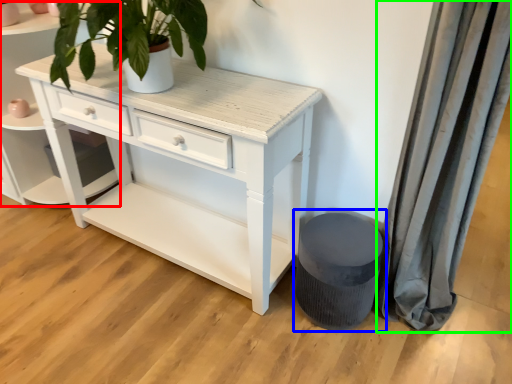
Question: Based on their relative distances, which object is nearer to shelf (highlighted by a red box)? Choose from music stool (highlighted by a blue box) and curtain (highlighted by a green box).

Choices:
 (A) music stool
 (B) curtain

Answer: (A)